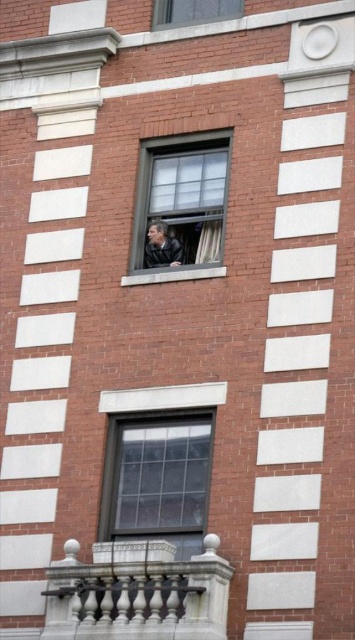
Question: Considering the relative positions of clear glass window at lower center and clear glass window at center in the image provided, where is clear glass window at lower center located with respect to clear glass window at center?

Choices:
 (A) above
 (B) below

Answer: (B)

Question: Which point is closer to the camera?

Choices:
 (A) dark gray leather jacket at center
 (B) white sheer curtain at center

Answer: (B)

Question: Can you confirm if white marble railing at lower center is positioned above clear glass window at upper center?

Choices:
 (A) no
 (B) yes

Answer: (A)

Question: Is white marble railing at lower center smaller than white sheer curtain at center?

Choices:
 (A) no
 (B) yes

Answer: (B)

Question: Considering the real-world distances, which object is closest to the white marble railing at lower center?

Choices:
 (A) clear glass window at center
 (B) clear glass window at upper center

Answer: (A)

Question: Which of the following is the closest to the observer?

Choices:
 (A) white marble railing at lower center
 (B) clear glass window at center
 (C) dark gray leather jacket at center

Answer: (A)